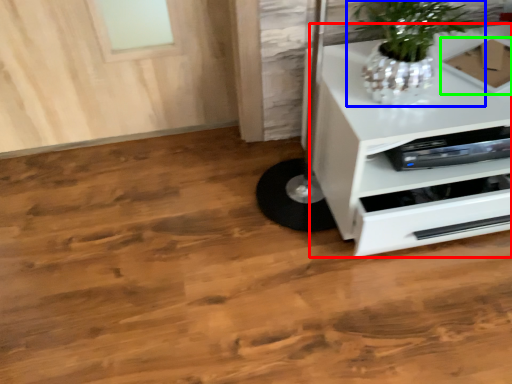
Question: Which is farther away from chest of drawers (highlighted by a red box)? houseplant (highlighted by a blue box) or cardboard box (highlighted by a green box)?

Choices:
 (A) houseplant
 (B) cardboard box

Answer: (B)